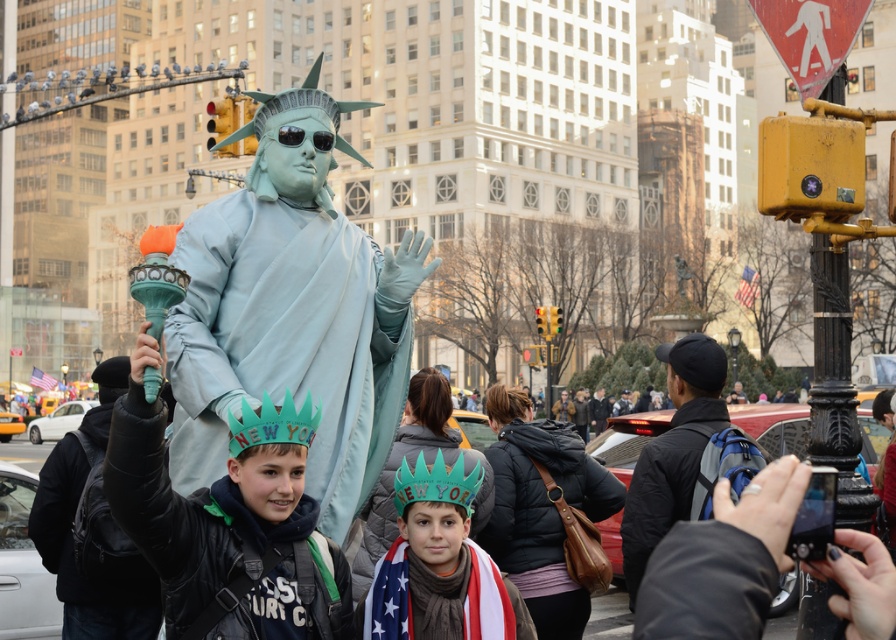
Who is more distant from viewer, (495, 582) or (497, 554)?

Point (497, 554)

Is point (378, 573) less distant than point (619, 486)?

Yes.

Which is behind, point (412, 500) or point (562, 600)?

The point (562, 600) is more distant.

I want to click on green felt crown at center, so click(438, 564).

Is matte blue statue at center positioned at the back of green paper crown at center?

Yes, it is behind green paper crown at center.

Between matte blue statue at center and green paper crown at center, which one appears on the right side from the viewer's perspective?

matte blue statue at center is more to the right.

Describe the element at coordinates (291, 308) in the screenshot. I see `matte blue statue at center` at that location.

Find the location of a particular element. matte blue statue at center is located at coordinates (291, 308).

Is matte blue statue at center below green felt crown at center?

No, matte blue statue at center is not below green felt crown at center.

Does point (252, 168) come behind point (464, 500)?

Yes.

This screenshot has width=896, height=640. What are the coordinates of `matte blue statue at center` in the screenshot? It's located at (291, 308).